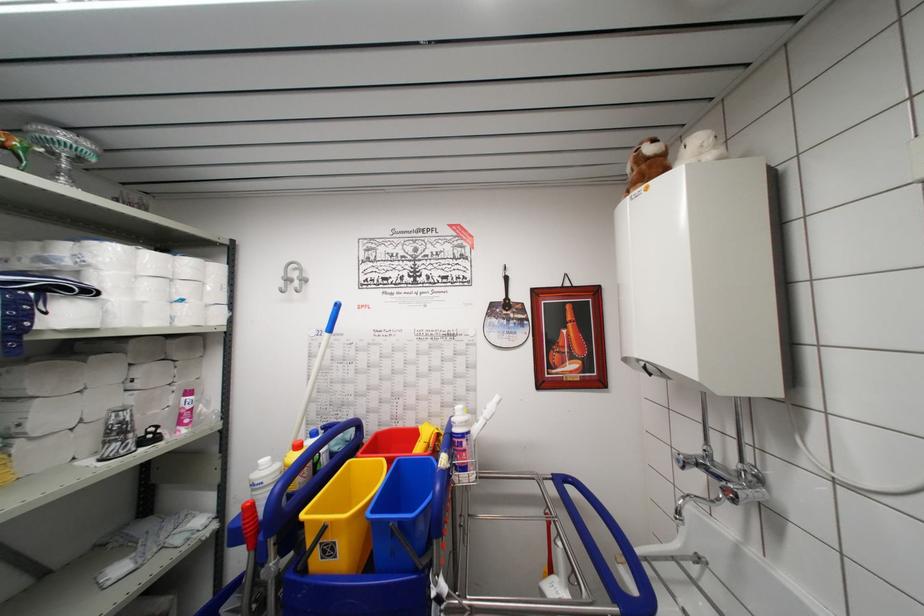
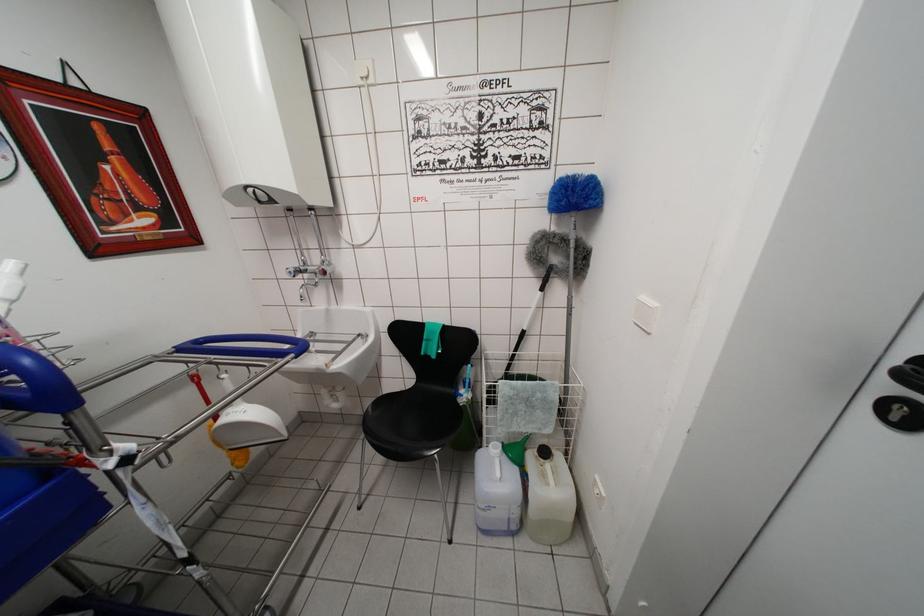
Find the pixel in the second image that matches (x=687, y=503) in the first image.

(305, 292)